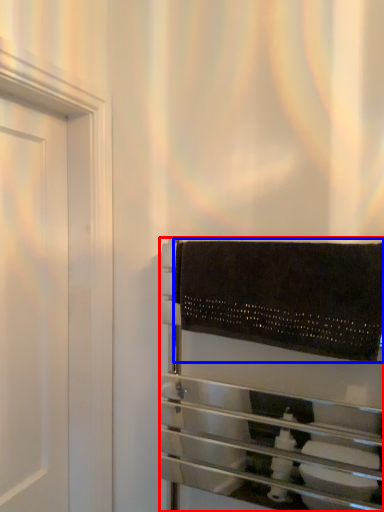
Question: Among these objects, which one is nearest to the camera, towel rack (highlighted by a red box) or bath towel (highlighted by a blue box)?

Choices:
 (A) towel rack
 (B) bath towel

Answer: (A)